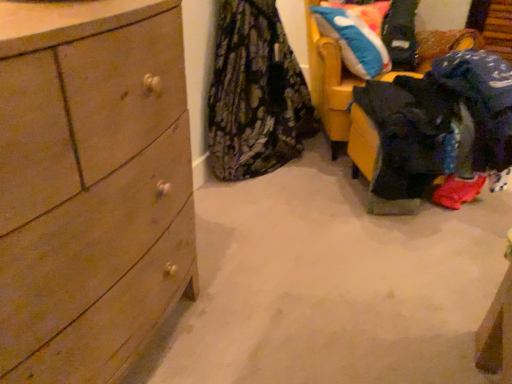
Where is `dark blue fabric at lower right, which is the second clothing from left to right`? The height and width of the screenshot is (384, 512). dark blue fabric at lower right, which is the second clothing from left to right is located at coordinates (441, 124).

Identify the location of the chest of drawers above the yellow fabric chair at upper right (from a real-world perspective). This screenshot has width=512, height=384. (91, 185).

Can you tell me how much wooden dresser at left and yellow fabric chair at upper right differ in facing direction?

The angle between the facing direction of wooden dresser at left and the facing direction of yellow fabric chair at upper right is 53.8 degrees.

Which object is more forward, wooden dresser at left or yellow fabric chair at upper right?

wooden dresser at left.

Which is more to the left, wooden dresser at left or yellow fabric chair at upper right?

wooden dresser at left is more to the left.

The width and height of the screenshot is (512, 384). In order to click on pillow that is on the right side of yellow fabric chair at upper right in this screenshot , I will do `click(353, 41)`.

Which is behind, blue plush pillow at upper right or yellow fabric chair at upper right?

blue plush pillow at upper right is further from the camera.

From the picture: Between blue plush pillow at upper right and yellow fabric chair at upper right, which one has smaller width?

blue plush pillow at upper right.

In the scene shown: Who is shorter, blue plush pillow at upper right or yellow fabric chair at upper right?

With less height is blue plush pillow at upper right.

Which of these two, floral fabric skirt at center, positioned as the 2th clothing in right-to-left order, or yellow fabric chair at upper right, is wider?

With larger width is yellow fabric chair at upper right.

In the scene shown: From a real-world perspective, is floral fabric skirt at center, the 1th clothing in the left-to-right sequence, located beneath yellow fabric chair at upper right?

Actually, floral fabric skirt at center, the 1th clothing in the left-to-right sequence, is physically above yellow fabric chair at upper right in the real world.

Is yellow fabric chair at upper right inside floral fabric skirt at center, the 1th clothing in the left-to-right sequence?

That's incorrect, yellow fabric chair at upper right is not inside floral fabric skirt at center, the 1th clothing in the left-to-right sequence.

Is point (310, 125) closer to viewer compared to point (309, 22)?

Yes, point (310, 125) is closer to viewer.

From a real-world perspective, who is located lower, yellow fabric chair at upper right or blue plush pillow at upper right?

yellow fabric chair at upper right.

Who is smaller, yellow fabric chair at upper right or blue plush pillow at upper right?

blue plush pillow at upper right is smaller.

Who is shorter, yellow fabric chair at upper right or blue plush pillow at upper right?

Standing shorter between the two is blue plush pillow at upper right.

Does point (330, 63) lie in front of point (370, 59)?

No, (330, 63) is behind (370, 59).

Is yellow fabric chair at upper right oriented away from dark blue fabric at lower right, which is the second clothing from left to right?

No, yellow fabric chair at upper right is not facing the opposite direction of dark blue fabric at lower right, which is the second clothing from left to right.

Is yellow fabric chair at upper right further to camera compared to dark blue fabric at lower right, which is the second clothing from left to right?

Yes.

Considering the positions of points (333, 134) and (432, 110), is point (333, 134) closer to camera compared to point (432, 110)?

No, (333, 134) is further to viewer.

Is yellow fabric chair at upper right touching dark blue fabric at lower right, which is the second clothing from left to right?

No, yellow fabric chair at upper right is not with dark blue fabric at lower right, which is the second clothing from left to right.

Does yellow fabric chair at upper right have a lesser width compared to floral fabric skirt at center, positioned as the 2th clothing in right-to-left order?

No, yellow fabric chair at upper right is not thinner than floral fabric skirt at center, positioned as the 2th clothing in right-to-left order.

What's the angular difference between yellow fabric chair at upper right and floral fabric skirt at center, the 1th clothing in the left-to-right sequence,'s facing directions?

The angle between the facing direction of yellow fabric chair at upper right and the facing direction of floral fabric skirt at center, the 1th clothing in the left-to-right sequence, is 55.7 degrees.

From the image's perspective, does yellow fabric chair at upper right appear lower than floral fabric skirt at center, the 1th clothing in the left-to-right sequence?

Actually, yellow fabric chair at upper right appears above floral fabric skirt at center, the 1th clothing in the left-to-right sequence, in the image.

From a real-world perspective, is yellow fabric chair at upper right positioned above or below floral fabric skirt at center, positioned as the 2th clothing in right-to-left order?

From a real-world perspective, yellow fabric chair at upper right is physically below floral fabric skirt at center, positioned as the 2th clothing in right-to-left order.

Which point is more forward, (331, 12) or (287, 129)?

Point (287, 129)

From the image's perspective, between blue plush pillow at upper right and floral fabric skirt at center, the 1th clothing in the left-to-right sequence, who is located below?

From the image's view, floral fabric skirt at center, the 1th clothing in the left-to-right sequence, is below.

Are blue plush pillow at upper right and floral fabric skirt at center, the 1th clothing in the left-to-right sequence, beside each other?

No, blue plush pillow at upper right is not with floral fabric skirt at center, the 1th clothing in the left-to-right sequence.

Considering the sizes of objects blue plush pillow at upper right and floral fabric skirt at center, the 1th clothing in the left-to-right sequence, in the image provided, who is bigger, blue plush pillow at upper right or floral fabric skirt at center, the 1th clothing in the left-to-right sequence,?

floral fabric skirt at center, the 1th clothing in the left-to-right sequence.

At what (x,y) coordinates should I click in order to perform the action: click on the chest of drawers in front of the yellow fabric chair at upper right. Please return your answer as a coordinate pair (x, y). This screenshot has height=384, width=512. Looking at the image, I should click on (91, 185).

Locate an element on the screen. The height and width of the screenshot is (384, 512). pillow above the yellow fabric chair at upper right (from the image's perspective) is located at coordinates (353, 41).

Based on their spatial positions, is blue plush pillow at upper right or floral fabric skirt at center, positioned as the 2th clothing in right-to-left order, further from wooden dresser at left?

blue plush pillow at upper right.

From the image, which object appears to be nearer to dark blue fabric at lower right, the first clothing in the right-to-left sequence, floral fabric skirt at center, the 1th clothing in the left-to-right sequence, or blue plush pillow at upper right?

blue plush pillow at upper right is closer to dark blue fabric at lower right, the first clothing in the right-to-left sequence.

Based on their spatial positions, is floral fabric skirt at center, positioned as the 2th clothing in right-to-left order, or dark blue fabric at lower right, the first clothing in the right-to-left sequence, closer to yellow fabric chair at upper right?

floral fabric skirt at center, positioned as the 2th clothing in right-to-left order, is closer to yellow fabric chair at upper right.

When comparing their distances from dark blue fabric at lower right, the first clothing in the right-to-left sequence, does wooden dresser at left or yellow fabric chair at upper right seem further?

The object further to dark blue fabric at lower right, the first clothing in the right-to-left sequence, is wooden dresser at left.

Which object lies nearer to the anchor point floral fabric skirt at center, the 1th clothing in the left-to-right sequence, yellow fabric chair at upper right or dark blue fabric at lower right, the first clothing in the right-to-left sequence?

yellow fabric chair at upper right.

From the image, which object appears to be nearer to yellow fabric chair at upper right, floral fabric skirt at center, positioned as the 2th clothing in right-to-left order, or blue plush pillow at upper right?

blue plush pillow at upper right.

Consider the image. Considering their positions, is wooden dresser at left positioned further to floral fabric skirt at center, positioned as the 2th clothing in right-to-left order, than blue plush pillow at upper right?

→ wooden dresser at left lies further to floral fabric skirt at center, positioned as the 2th clothing in right-to-left order, than the other object.

When comparing their distances from blue plush pillow at upper right, does yellow fabric chair at upper right or floral fabric skirt at center, the 1th clothing in the left-to-right sequence, seem closer?

Among the two, yellow fabric chair at upper right is located nearer to blue plush pillow at upper right.

Where is `furniture situated between floral fabric skirt at center, the 1th clothing in the left-to-right sequence, and blue plush pillow at upper right from left to right`? The height and width of the screenshot is (384, 512). furniture situated between floral fabric skirt at center, the 1th clothing in the left-to-right sequence, and blue plush pillow at upper right from left to right is located at coordinates (330, 86).

Where is `furniture between wooden dresser at left and dark blue fabric at lower right, the first clothing in the right-to-left sequence, from left to right`? The height and width of the screenshot is (384, 512). furniture between wooden dresser at left and dark blue fabric at lower right, the first clothing in the right-to-left sequence, from left to right is located at coordinates (330, 86).

Where is `furniture between dark blue fabric at lower right, the first clothing in the right-to-left sequence, and blue plush pillow at upper right in the front-back direction`? This screenshot has height=384, width=512. furniture between dark blue fabric at lower right, the first clothing in the right-to-left sequence, and blue plush pillow at upper right in the front-back direction is located at coordinates (330, 86).

Where is `clothing between wooden dresser at left and dark blue fabric at lower right, the first clothing in the right-to-left sequence`? The image size is (512, 384). clothing between wooden dresser at left and dark blue fabric at lower right, the first clothing in the right-to-left sequence is located at coordinates (255, 94).